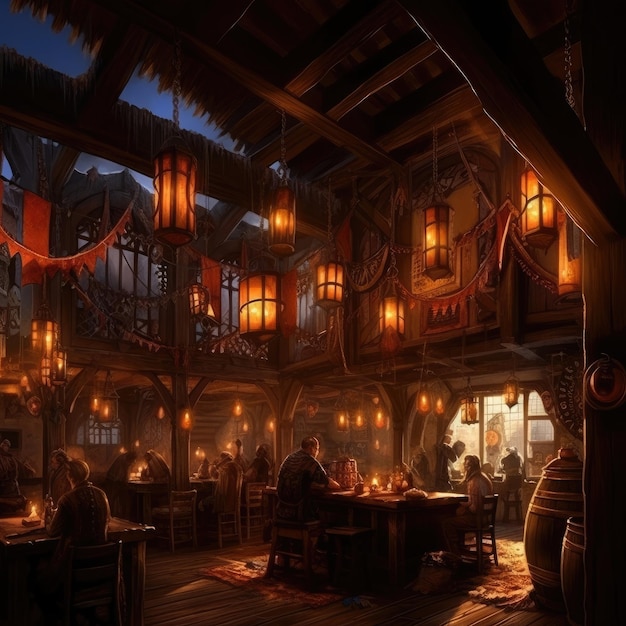
You are a GUI agent. You are given a task and a screenshot of the screen. Output one action in this format:
    pyautogui.click(x=<x>, y=<y>)
    Task: Click on the empty space on floor
    
    Given the screenshot: What is the action you would take?
    pyautogui.click(x=173, y=573)